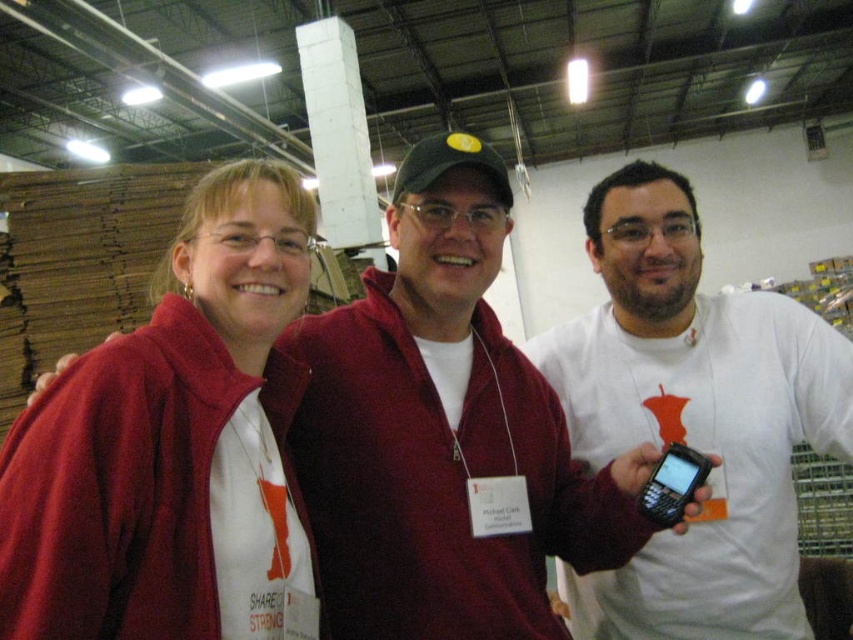
Question: Is matte red jacket at center wider than white matte shirt at center?

Choices:
 (A) yes
 (B) no

Answer: (B)

Question: Which point appears farthest from the camera in this image?

Choices:
 (A) (238, 406)
 (B) (589, 225)

Answer: (B)

Question: Does matte red jacket at center have a smaller size compared to white matte shirt at center?

Choices:
 (A) yes
 (B) no

Answer: (A)

Question: Observing the image, what is the correct spatial positioning of matte red jacket at center in reference to white matte shirt at center?

Choices:
 (A) below
 (B) above

Answer: (B)

Question: Which object appears farthest from the camera in this image?

Choices:
 (A) matte red jacket at center
 (B) white matte shirt at center

Answer: (B)